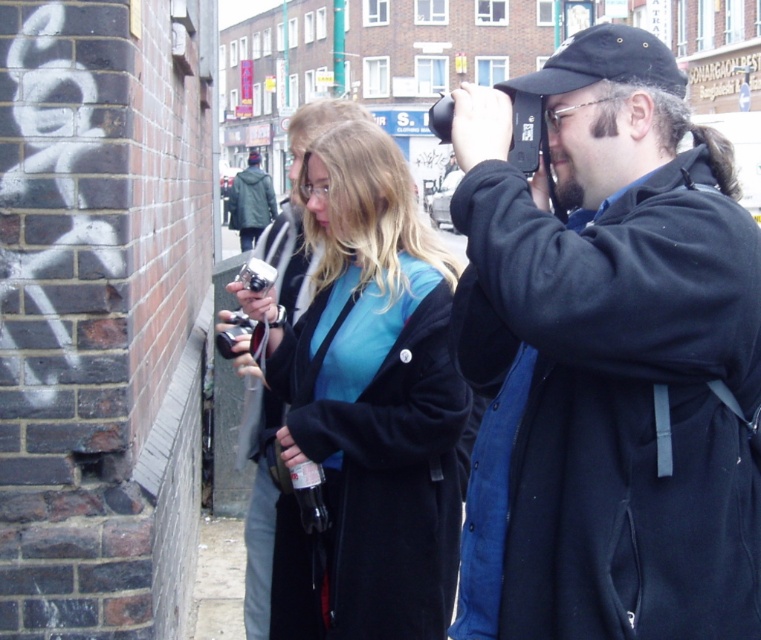
Question: Which point appears farthest from the camera in this image?

Choices:
 (A) (449, 369)
 (B) (237, 211)

Answer: (B)

Question: Is matte black jacket at center to the left of blue matte jacket at center from the viewer's perspective?

Choices:
 (A) yes
 (B) no

Answer: (B)

Question: Which of the following is the farthest from the observer?

Choices:
 (A) blue matte jacket at center
 (B) matte black jacket at center

Answer: (A)

Question: Which is farther from the matte black jacket at center?

Choices:
 (A) green matte jacket at center
 (B) blue matte jacket at center

Answer: (A)

Question: Does matte black jacket at center appear over green matte jacket at center?

Choices:
 (A) yes
 (B) no

Answer: (B)

Question: Is the position of matte black jacket at center less distant than that of blue matte jacket at center?

Choices:
 (A) yes
 (B) no

Answer: (A)